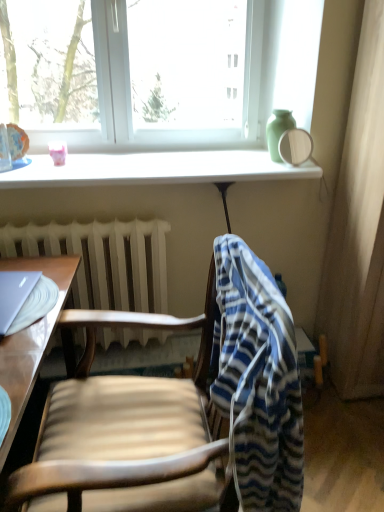
Question: From the image's perspective, is white plastic window at upper center positioned above or below white glossy window sill at upper center?

Choices:
 (A) below
 (B) above

Answer: (B)

Question: Is white plastic window at upper center bigger or smaller than white glossy window sill at upper center?

Choices:
 (A) big
 (B) small

Answer: (A)

Question: Which is farther from the wooden chair at center?

Choices:
 (A) white plastic window at upper center
 (B) light brown wooden desk at left
 (C) blue striped fabric at center
 (D) green matte vase at upper right
 (E) transparent glass mirror at upper right

Answer: (E)

Question: Which of these objects is positioned closest to the wooden chair at center?

Choices:
 (A) satin silver laptop at left
 (B) white matte radiator at lower center
 (C) white plastic window at upper center
 (D) green matte vase at upper right
 (E) white glossy window sill at upper center

Answer: (A)